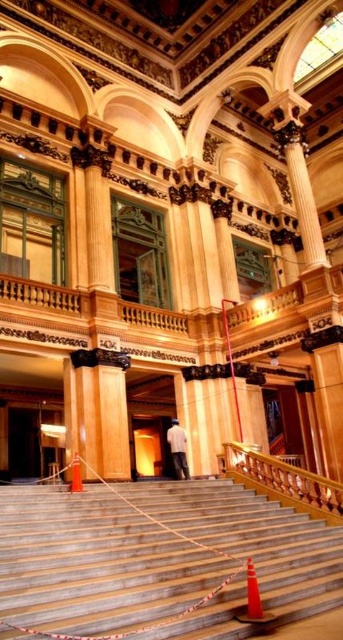
Does white matte shirt at center have a smaller size compared to orange cone at center?

No.

Find the location of `white matte shirt at center`. white matte shirt at center is located at coordinates pos(178,449).

Who is more distant from viewer, (x=181, y=451) or (x=75, y=452)?

The point (x=181, y=451) is behind.

The height and width of the screenshot is (640, 343). I want to click on white matte shirt at center, so click(x=178, y=449).

Does wooden staircase at center lie behind wooden at center?

No, it is in front of wooden at center.

I want to click on wooden staircase at center, so click(155, 554).

Where is `wooden staircase at center`? wooden staircase at center is located at coordinates (155, 554).

Between wooden staircase at center and white matte shirt at center, which one is positioned higher?

wooden staircase at center is above.

Describe the element at coordinates (155, 554) in the screenshot. I see `wooden staircase at center` at that location.

Where is `wooden staircase at center`? This screenshot has width=343, height=640. wooden staircase at center is located at coordinates (155, 554).